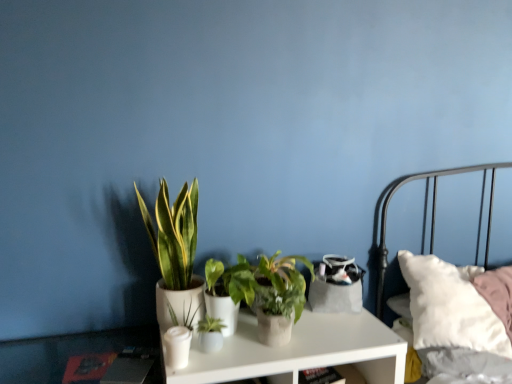
The image size is (512, 384). What do you see at coordinates (210, 334) in the screenshot?
I see `green matte plant at center, which ranks as the 3th houseplant in right-to-left order` at bounding box center [210, 334].

You are a GUI agent. You are given a task and a screenshot of the screen. Output one action in this format:
    pyautogui.click(x=<x>, y=<y>)
    Task: Click on the white matte nightstand at center
    The width and height of the screenshot is (512, 384).
    Given the screenshot: What is the action you would take?
    pyautogui.click(x=300, y=351)

Where is `green matte plant at center, which is the 4th houseplant from left to right`? This screenshot has height=384, width=512. green matte plant at center, which is the 4th houseplant from left to right is located at coordinates (273, 294).

This screenshot has height=384, width=512. Find the location of `green matte plant at center, the 2th houseplant when ordered from left to right`. green matte plant at center, the 2th houseplant when ordered from left to right is located at coordinates (210, 334).

Which of these two, green matte plant at center or white matte nightstand at center, stands shorter?

Standing shorter between the two is green matte plant at center.

Identify the location of plant on the left of white matte nightstand at center. The image size is (512, 384). (188, 316).

Between green matte plant at center and white matte nightstand at center, which one appears on the right side from the viewer's perspective?

white matte nightstand at center.

Can we say green matte plant at center lies outside white matte nightstand at center?

green matte plant at center is positioned outside white matte nightstand at center.

Could you measure the distance between green glossy plant at center, which ranks as the first houseplant in left-to-right order, and white matte nightstand at center?

green glossy plant at center, which ranks as the first houseplant in left-to-right order, and white matte nightstand at center are 12.77 inches apart.

Considering the relative positions of green glossy plant at center, which is the 4th houseplant in right-to-left order, and white matte nightstand at center in the image provided, is green glossy plant at center, which is the 4th houseplant in right-to-left order, to the right of white matte nightstand at center from the viewer's perspective?

No.

Is green glossy plant at center, which is the 4th houseplant in right-to-left order, inside the boundaries of white matte nightstand at center, or outside?

green glossy plant at center, which is the 4th houseplant in right-to-left order, is not enclosed by white matte nightstand at center.

Are green glossy plant at center, which ranks as the first houseplant in left-to-right order, and white matte nightstand at center far apart?

No.

Is green glossy plant at center, which is the 4th houseplant in right-to-left order, not near green matte plant at center, the 2th houseplant in the right-to-left sequence?

They are positioned close to each other.

Is green glossy plant at center, which ranks as the first houseplant in left-to-right order, positioned with its back to green matte plant at center, the 3th houseplant viewed from the left?

No, green glossy plant at center, which ranks as the first houseplant in left-to-right order, is not facing the opposite direction of green matte plant at center, the 3th houseplant viewed from the left.

In terms of width, does green glossy plant at center, which is the 4th houseplant in right-to-left order, look wider or thinner when compared to green matte plant at center, the 3th houseplant viewed from the left?

green glossy plant at center, which is the 4th houseplant in right-to-left order, is thinner than green matte plant at center, the 3th houseplant viewed from the left.

At what (x,y) coordinates should I click in order to perform the action: click on the 2nd houseplant above the green matte plant at center, the 3th houseplant viewed from the left (from the image's perspective). Please return your answer as a coordinate pair (x, y). Looking at the image, I should click on (x=175, y=256).

Could you tell me if green matte plant at center, which is the 4th houseplant from left to right, is facing green matte plant at center, which ranks as the 3th houseplant in right-to-left order?

No, green matte plant at center, which is the 4th houseplant from left to right, is not turned towards green matte plant at center, which ranks as the 3th houseplant in right-to-left order.

Does green matte plant at center, which is the 4th houseplant from left to right, lie in front of green matte plant at center, the 2th houseplant when ordered from left to right?

No, green matte plant at center, which is the 4th houseplant from left to right, is further to the viewer.

From a real-world perspective, which is physically above, green matte plant at center, which is the 4th houseplant from left to right, or green matte plant at center, the 2th houseplant when ordered from left to right?

From a 3D spatial view, green matte plant at center, which is the 4th houseplant from left to right, is above.

Which is less distant, (278, 317) or (215, 333)?

Point (278, 317) is positioned closer to the camera compared to point (215, 333).

Considering the sizes of green matte plant at center and green glossy plant at center, which is the 4th houseplant in right-to-left order, in the image, is green matte plant at center taller or shorter than green glossy plant at center, which is the 4th houseplant in right-to-left order,?

Considering their sizes, green matte plant at center has less height than green glossy plant at center, which is the 4th houseplant in right-to-left order.

You are a GUI agent. You are given a task and a screenshot of the screen. Output one action in this format:
    pyautogui.click(x=<x>, y=<y>)
    Task: Click on the plant on the right of green glossy plant at center, which is the 4th houseplant in right-to-left order
    The width and height of the screenshot is (512, 384).
    Given the screenshot: What is the action you would take?
    pyautogui.click(x=188, y=316)

Is point (194, 315) closer to camera compared to point (172, 268)?

That is True.

In terms of width, does green matte plant at center, which is the 4th houseplant from left to right, look wider or thinner when compared to green matte plant at center?

Considering their sizes, green matte plant at center, which is the 4th houseplant from left to right, looks broader than green matte plant at center.

In the scene shown: Is green matte plant at center, which is the 4th houseplant from left to right, in front of green matte plant at center?

No, green matte plant at center, which is the 4th houseplant from left to right, is further to the viewer.

Can you tell me how much green matte plant at center, which is the 4th houseplant from left to right, and green matte plant at center differ in facing direction?

The angular difference between green matte plant at center, which is the 4th houseplant from left to right, and green matte plant at center is 1.73 degrees.

Is green matte plant at center, which is counted as the first houseplant, starting from the right, not within green matte plant at center?

green matte plant at center, which is counted as the first houseplant, starting from the right, lies outside green matte plant at center's area.

Considering the relative positions of green matte plant at center, the 3th houseplant viewed from the left, and green matte plant at center, which is the 4th houseplant from left to right, in the image provided, is green matte plant at center, the 3th houseplant viewed from the left, to the right of green matte plant at center, which is the 4th houseplant from left to right, from the viewer's perspective?

Incorrect, green matte plant at center, the 3th houseplant viewed from the left, is not on the right side of green matte plant at center, which is the 4th houseplant from left to right.

From a real-world perspective, is green matte plant at center, the 2th houseplant in the right-to-left sequence, positioned over green matte plant at center, which is the 4th houseplant from left to right, based on gravity?

No, from a real-world perspective, green matte plant at center, the 2th houseplant in the right-to-left sequence, is not above green matte plant at center, which is the 4th houseplant from left to right.

Could you tell me if green matte plant at center, the 2th houseplant in the right-to-left sequence, is facing green matte plant at center, which is counted as the first houseplant, starting from the right?

No, green matte plant at center, the 2th houseplant in the right-to-left sequence, is not turned towards green matte plant at center, which is counted as the first houseplant, starting from the right.

You are a GUI agent. You are given a task and a screenshot of the screen. Output one action in this format:
    pyautogui.click(x=<x>, y=<y>)
    Task: Click on the nightstand below the green matte plant at center (from the image's perspective)
    This screenshot has height=384, width=512.
    Given the screenshot: What is the action you would take?
    pyautogui.click(x=300, y=351)

Image resolution: width=512 pixels, height=384 pixels. In the image, there is a green glossy plant at center, which is the 4th houseplant in right-to-left order. Find the location of `nightstand below it (from a real-world perspective)`. nightstand below it (from a real-world perspective) is located at coordinates (300, 351).

Looking at the image, which one is located closer to white matte nightstand at center, green glossy plant at center, which ranks as the first houseplant in left-to-right order, or green matte plant at center, the 2th houseplant when ordered from left to right?

green matte plant at center, the 2th houseplant when ordered from left to right.

Estimate the real-world distances between objects in this image. Which object is closer to green matte plant at center, which is the 4th houseplant from left to right, green matte plant at center, the 2th houseplant when ordered from left to right, or white matte nightstand at center?

The object closer to green matte plant at center, which is the 4th houseplant from left to right, is white matte nightstand at center.

Considering their positions, is green matte plant at center, the 2th houseplant in the right-to-left sequence, positioned further to green glossy plant at center, which ranks as the first houseplant in left-to-right order, than green matte plant at center, which is the 4th houseplant from left to right?

green matte plant at center, which is the 4th houseplant from left to right, is further to green glossy plant at center, which ranks as the first houseplant in left-to-right order.

Looking at the image, which one is located closer to green matte plant at center, which ranks as the 3th houseplant in right-to-left order, green matte plant at center or green matte plant at center, which is the 4th houseplant from left to right?

green matte plant at center is closer to green matte plant at center, which ranks as the 3th houseplant in right-to-left order.

Which object lies further to the anchor point green glossy plant at center, which is the 4th houseplant in right-to-left order, green matte plant at center, which is the 4th houseplant from left to right, or green matte plant at center?

green matte plant at center, which is the 4th houseplant from left to right, is further to green glossy plant at center, which is the 4th houseplant in right-to-left order.

Considering their positions, is green matte plant at center positioned further to white matte nightstand at center than green matte plant at center, the 2th houseplant in the right-to-left sequence?

Based on the image, green matte plant at center appears to be further to white matte nightstand at center.

Which object lies nearer to the anchor point green matte plant at center, which ranks as the 3th houseplant in right-to-left order, white matte nightstand at center or green glossy plant at center, which ranks as the first houseplant in left-to-right order?

green glossy plant at center, which ranks as the first houseplant in left-to-right order.

Considering their positions, is green matte plant at center, the 2th houseplant in the right-to-left sequence, positioned closer to green matte plant at center than green matte plant at center, which is the 4th houseplant from left to right?

green matte plant at center, the 2th houseplant in the right-to-left sequence, lies closer to green matte plant at center than the other object.

Image resolution: width=512 pixels, height=384 pixels. Identify the location of plant located between green glossy plant at center, which ranks as the first houseplant in left-to-right order, and green matte plant at center, which is the 4th houseplant from left to right, in the left-right direction. (188, 316).

At what (x,y) coordinates should I click in order to perform the action: click on plant between green glossy plant at center, which ranks as the first houseplant in left-to-right order, and white matte nightstand at center vertically. Please return your answer as a coordinate pair (x, y). Looking at the image, I should click on (188, 316).

The image size is (512, 384). Identify the location of houseplant between green matte plant at center and green matte plant at center, the 3th houseplant viewed from the left. (210, 334).

This screenshot has height=384, width=512. What are the coordinates of `nightstand between green matte plant at center and green matte plant at center, which is counted as the first houseplant, starting from the right, from left to right` in the screenshot? It's located at (300, 351).